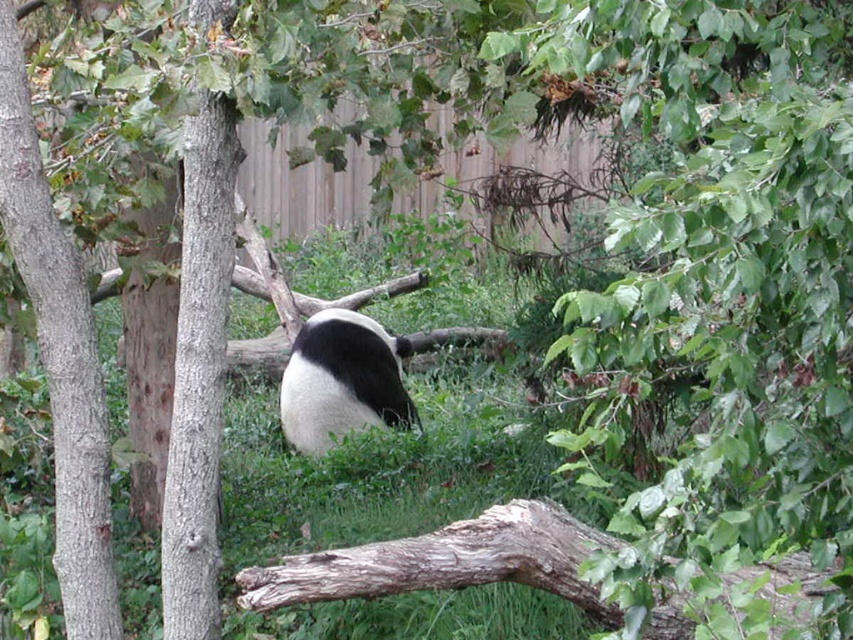
Question: Is brown rough tree trunk at left further to camera compared to gray rough bark tree trunk at left?

Choices:
 (A) no
 (B) yes

Answer: (B)

Question: Which object is farther from the camera taking this photo?

Choices:
 (A) black and white fur panda at center
 (B) brown rough tree trunk at left

Answer: (A)

Question: Considering the relative positions of brown rough tree trunk at left and black and white fur panda at center in the image provided, where is brown rough tree trunk at left located with respect to black and white fur panda at center?

Choices:
 (A) left
 (B) right

Answer: (A)

Question: Which object appears farthest from the camera in this image?

Choices:
 (A) black and white fur panda at center
 (B) gray rough bark tree trunk at left

Answer: (A)

Question: Does brown rough tree trunk at left have a larger size compared to gray rough bark tree trunk at left?

Choices:
 (A) yes
 (B) no

Answer: (B)

Question: Based on their relative distances, which object is farther from the gray rough bark tree trunk at left?

Choices:
 (A) black and white fur panda at center
 (B) brown rough tree trunk at left

Answer: (A)